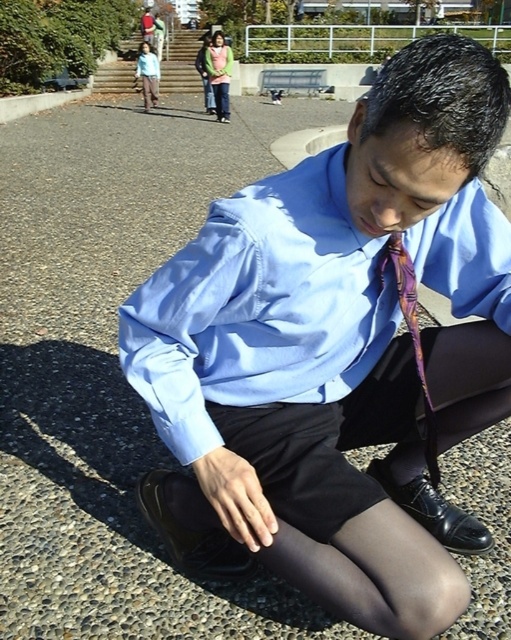
You are a photographer trying to capture the person in the scene. You want to focus on the matte blue shirt at center and the purple silky tie at center. From the viewer perspective, which one is positioned to the left?

The matte blue shirt at center is positioned to the left of the purple silky tie at center.

You are a photographer taking a portrait of the person in the matte blue shirt at center and purple silky tie at center. Which clothing item will appear more prominent in the photo due to its size?

The matte blue shirt at center is larger in size than the purple silky tie at center, so it will appear more prominent in the photo.